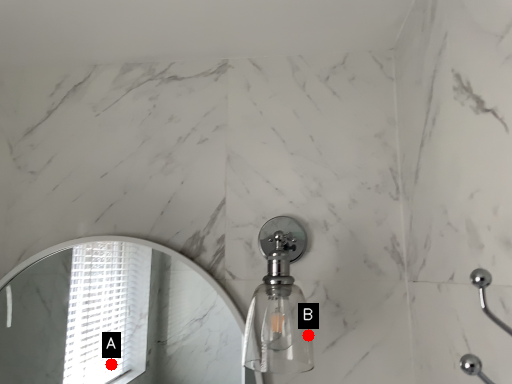
Question: Two points are circled on the image, labeled by A and B beside each circle. Which point is closer to the camera taking this photo?

Choices:
 (A) A is closer
 (B) B is closer

Answer: (B)